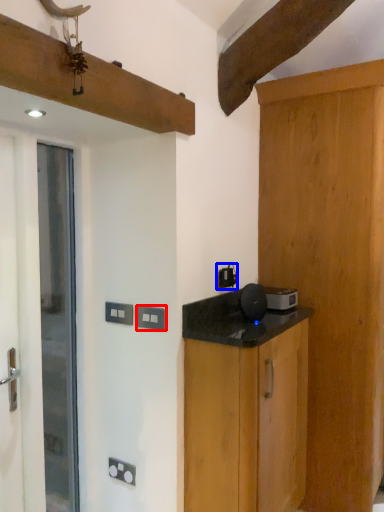
Question: Which of the following is the farthest to the observer, electric outlet (highlighted by a red box) or electric outlet (highlighted by a blue box)?

Choices:
 (A) electric outlet
 (B) electric outlet

Answer: (B)